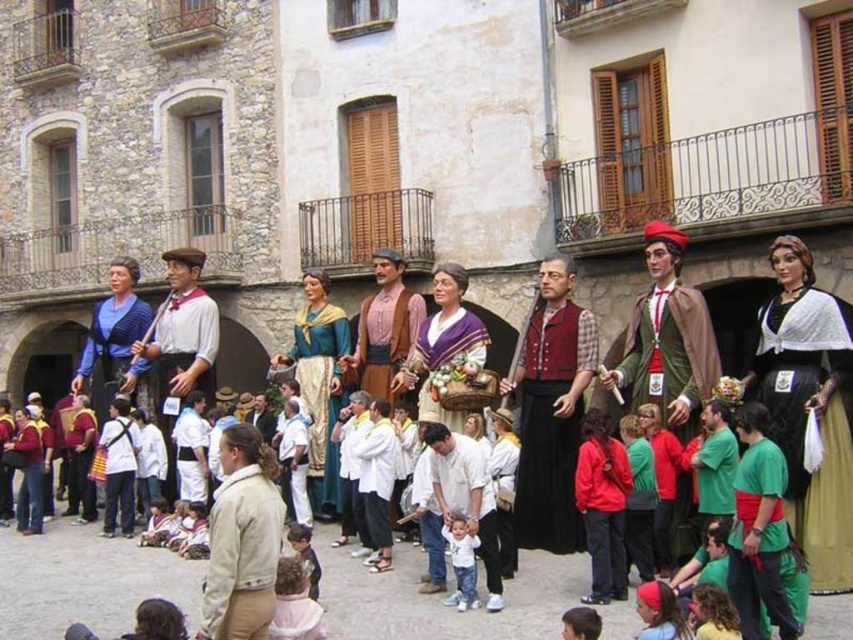
Question: Which of the following is the farthest from the observer?

Choices:
 (A) rustic brown fabric at center
 (B) velvet red vest at center
 (C) beige cotton jacket at center
 (D) white cotton shirt at center

Answer: (A)

Question: Does white cotton shirt at center appear over purple velvet basket at center?

Choices:
 (A) no
 (B) yes

Answer: (A)

Question: Which of the following is the closest to the observer?

Choices:
 (A) (316, 448)
 (B) (486, 518)
 (C) (833, 298)

Answer: (B)

Question: Does green velvet suit at center come behind purple velvet basket at center?

Choices:
 (A) yes
 (B) no

Answer: (B)

Question: Which point appears closest to the camera in this image?

Choices:
 (A) (566, 474)
 (B) (195, 384)
 (C) (641, 358)
 (D) (204, 593)

Answer: (D)

Question: Is beige cotton jacket at center to the right of purple velvet basket at center from the viewer's perspective?

Choices:
 (A) no
 (B) yes

Answer: (A)